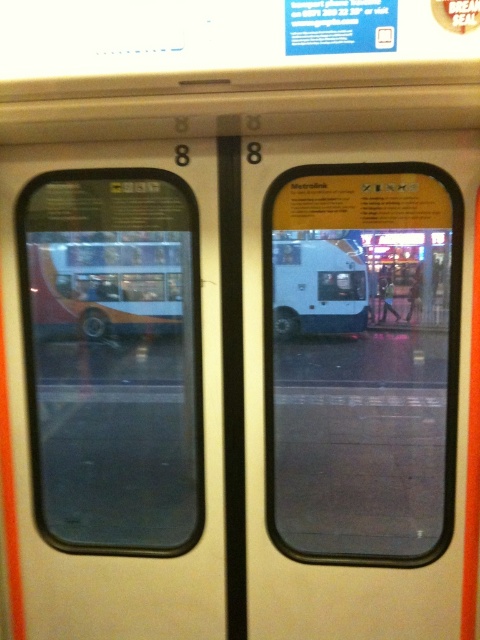
Is transparent glass window at right to the right of metallic silver bus at left from the viewer's perspective?

Indeed, transparent glass window at right is positioned on the right side of metallic silver bus at left.

Is transparent glass window at right wider than metallic silver bus at left?

Indeed, transparent glass window at right has a greater width compared to metallic silver bus at left.

Is point (356, 493) closer to viewer compared to point (84, 252)?

Yes, it is in front of point (84, 252).

The height and width of the screenshot is (640, 480). What are the coordinates of `transparent glass window at right` in the screenshot? It's located at (361, 362).

Who is more distant from viewer, (144, 380) or (280, 273)?

Point (144, 380)

Describe the element at coordinates (112, 358) in the screenshot. I see `transparent glass window at left` at that location.

Find the location of a particular element. transparent glass window at left is located at coordinates (112, 358).

Measure the distance between transparent glass window at right and white matte coach at right.

transparent glass window at right is 37.23 centimeters from white matte coach at right.

Does point (450, 445) lie behind point (392, 314)?

No, (450, 445) is in front of (392, 314).

Is point (454, 282) behind point (386, 288)?

That is False.

The image size is (480, 640). In order to click on transparent glass window at right in this screenshot , I will do `click(361, 362)`.